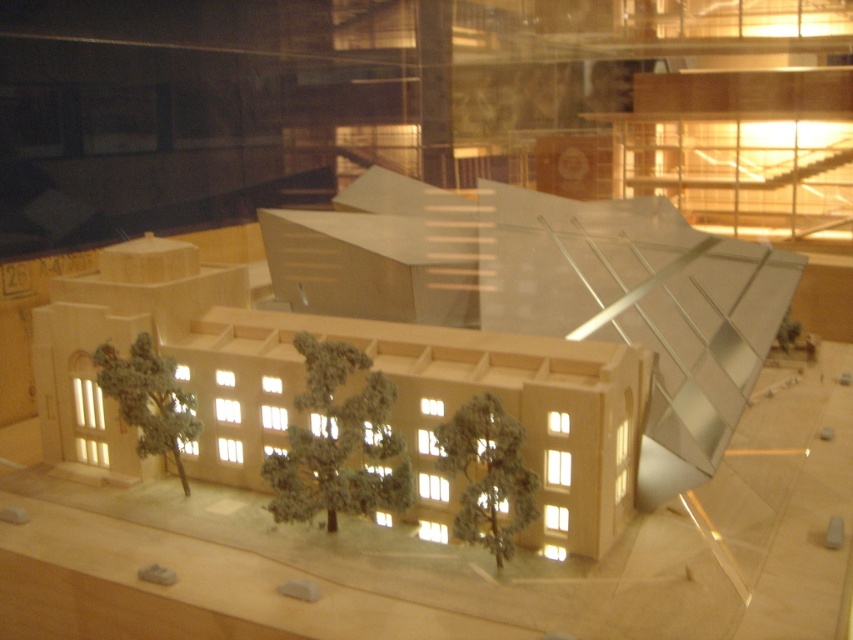
You are an architect examining the miniature model of the building. There is a point labeled at coordinates (486,476) in the image. What object is located at that point?

The point at coordinates (486,476) corresponds to the green matte tree at center.